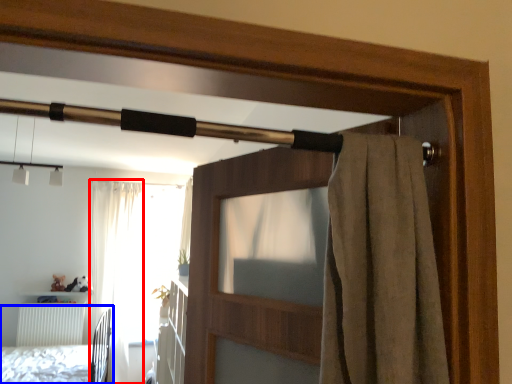
Question: Which of the following is the closest to the observer, curtain (highlighted by a red box) or bed (highlighted by a blue box)?

Choices:
 (A) curtain
 (B) bed

Answer: (B)